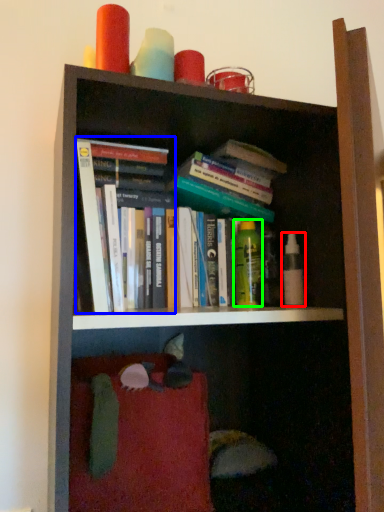
Question: Estimate the real-world distances between objects in this image. Which object is closer to toiletry (highlighted by a red box), book (highlighted by a blue box) or toiletry (highlighted by a green box)?

Choices:
 (A) book
 (B) toiletry

Answer: (B)